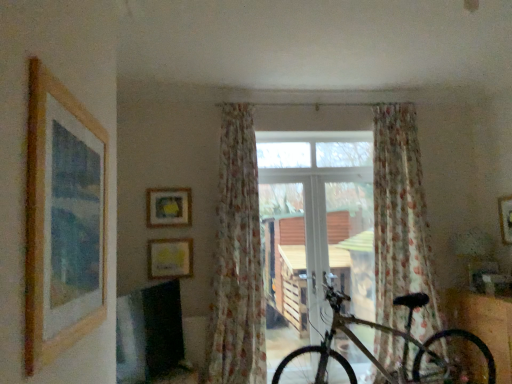
Question: Is the depth of floral sheer curtain at center, the 2th curtain when ordered from right to left, less than that of matte yellow picture frame at upper center, the 4th picture frame in the right-to-left sequence?

Choices:
 (A) no
 (B) yes

Answer: (B)

Question: From a real-world perspective, is floral sheer curtain at center, which is the 1th curtain from left to right, below matte yellow picture frame at upper center, marked as the first picture frame in a left-to-right arrangement?

Choices:
 (A) yes
 (B) no

Answer: (A)

Question: Does floral sheer curtain at center, the 2th curtain when ordered from right to left, appear on the left side of matte yellow picture frame at upper center, arranged as the fourth picture frame when viewed from the front?

Choices:
 (A) no
 (B) yes

Answer: (A)

Question: Is floral sheer curtain at center, which is the 1th curtain from left to right, outside matte yellow picture frame at upper center, arranged as the fourth picture frame when viewed from the front?

Choices:
 (A) no
 (B) yes

Answer: (B)

Question: Considering the relative sizes of floral sheer curtain at center, the 2th curtain when ordered from right to left, and matte yellow picture frame at upper center, arranged as the fourth picture frame when viewed from the front, in the image provided, is floral sheer curtain at center, the 2th curtain when ordered from right to left, thinner than matte yellow picture frame at upper center, arranged as the fourth picture frame when viewed from the front,?

Choices:
 (A) no
 (B) yes

Answer: (A)

Question: Is floral sheer curtain at center, the 2th curtain when ordered from right to left, to the right of matte yellow picture frame at upper center, arranged as the fourth picture frame when viewed from the front, from the viewer's perspective?

Choices:
 (A) yes
 (B) no

Answer: (A)

Question: Considering the relative positions of floral sheer curtain at center, the 2th curtain when ordered from right to left, and gold metallic bicycle at center in the image provided, is floral sheer curtain at center, the 2th curtain when ordered from right to left, behind gold metallic bicycle at center?

Choices:
 (A) yes
 (B) no

Answer: (A)

Question: Would you say floral sheer curtain at center, which is the 1th curtain from left to right, contains gold metallic bicycle at center?

Choices:
 (A) yes
 (B) no

Answer: (B)

Question: From the image's perspective, is floral sheer curtain at center, which is the 1th curtain from left to right, beneath gold metallic bicycle at center?

Choices:
 (A) no
 (B) yes

Answer: (A)

Question: Can you confirm if floral sheer curtain at center, which is the 1th curtain from left to right, is positioned to the left of gold metallic bicycle at center?

Choices:
 (A) no
 (B) yes

Answer: (B)

Question: Would you say floral sheer curtain at center, which is the 1th curtain from left to right, is outside gold metallic bicycle at center?

Choices:
 (A) yes
 (B) no

Answer: (A)

Question: From the image's perspective, is floral sheer curtain at center, which is the 1th curtain from left to right, on top of gold metallic bicycle at center?

Choices:
 (A) yes
 (B) no

Answer: (A)

Question: Does metallic silver bicycle at lower right appear on the left side of wooden picture frame at left, the second picture frame viewed from the right?

Choices:
 (A) no
 (B) yes

Answer: (A)